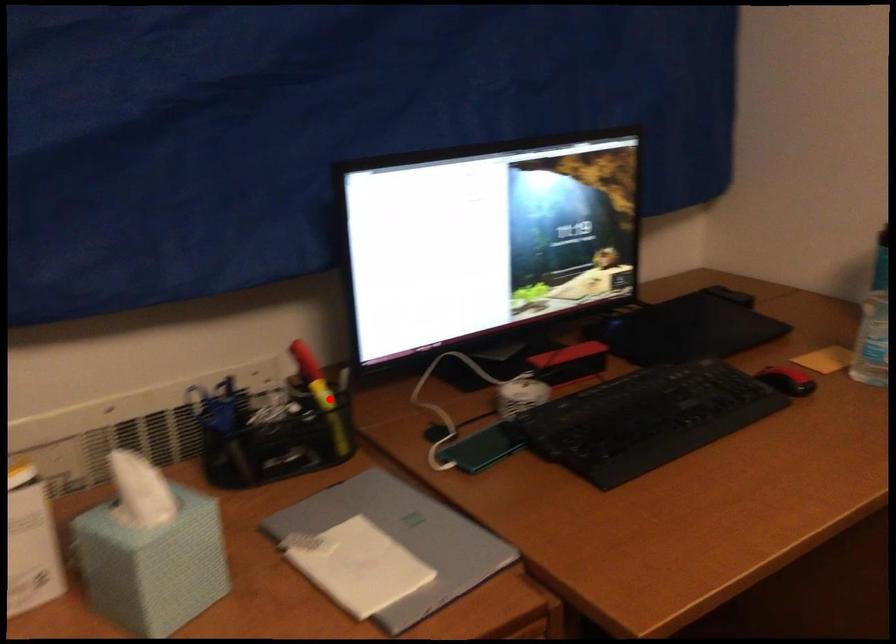
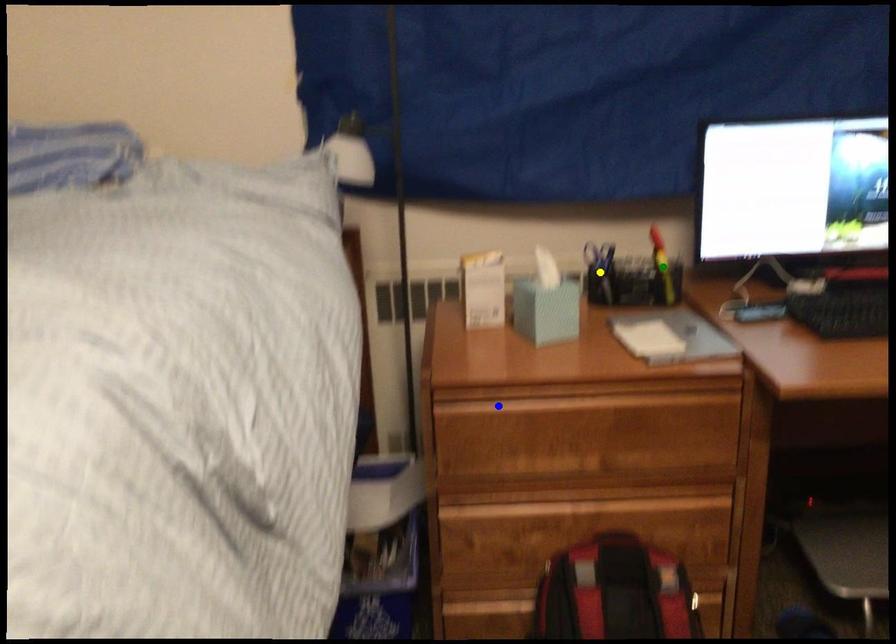
Question: I am providing you with two images of the same scene from different viewpoints. A red point is marked on the first image. You are given multiple points on the second image. Which point in image 2 represents the same 3d spot as the red point in image 1?

Choices:
 (A) yellow point
 (B) green point
 (C) blue point

Answer: (B)